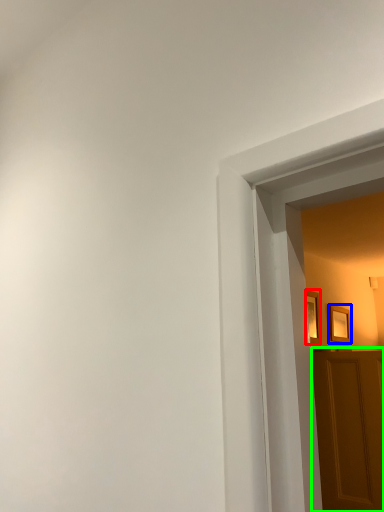
Question: Which object is positioned farthest from picture frame (highlighted by a red box)? Select from picture frame (highlighted by a blue box) and door (highlighted by a green box).

Choices:
 (A) picture frame
 (B) door

Answer: (B)